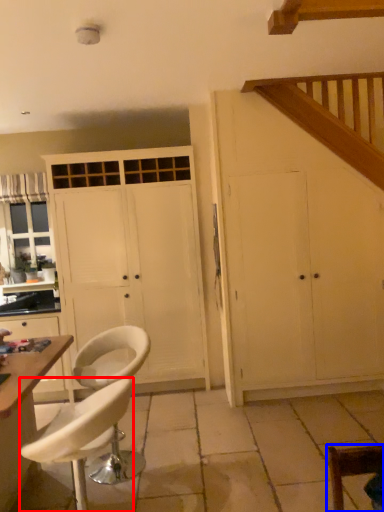
Question: Which of the following is the closest to the observer, chair (highlighted by a red box) or chair (highlighted by a blue box)?

Choices:
 (A) chair
 (B) chair

Answer: (B)